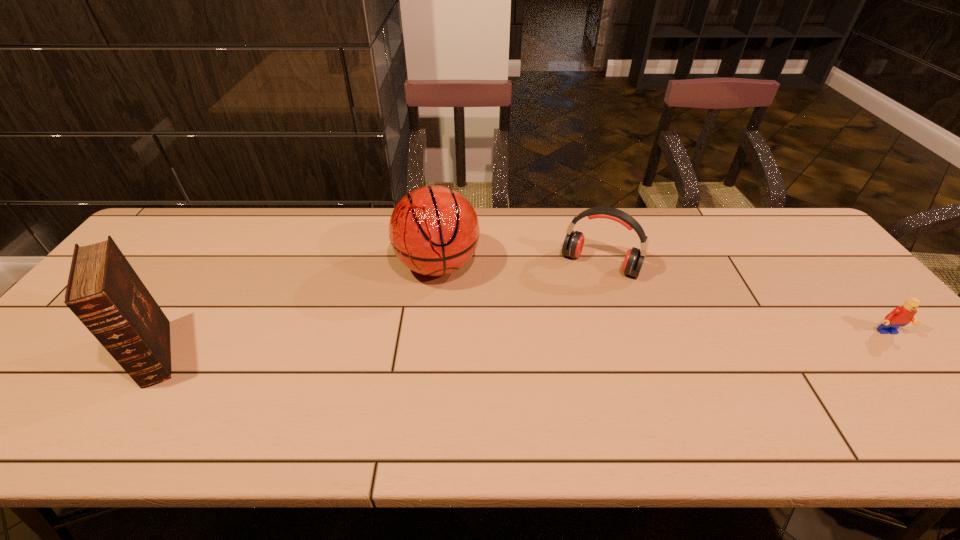
At what (x,y) coordinates should I click in order to perform the action: click on free region located on the ear cups of the second object from right to left. Please return your answer as a coordinate pair (x, y). The height and width of the screenshot is (540, 960). Looking at the image, I should click on (566, 325).

I want to click on blank space located 0.150m on the side with spill of the basketball, so click(x=443, y=338).

Locate an element on the screen. The width and height of the screenshot is (960, 540). free space located on the side with spill of the basketball is located at coordinates (442, 320).

The height and width of the screenshot is (540, 960). Find the location of `vacant area situated on the side with spill of the basketball`. vacant area situated on the side with spill of the basketball is located at coordinates (442, 326).

You are a GUI agent. You are given a task and a screenshot of the screen. Output one action in this format:
    pyautogui.click(x=<x>, y=<y>)
    Task: Click on the earphone at the far edge
    
    Given the screenshot: What is the action you would take?
    pyautogui.click(x=573, y=244)

In order to click on basketball at the far edge in this screenshot , I will do `click(434, 230)`.

Find the location of a particular element. The image size is (960, 540). object located in the near edge section of the desktop is located at coordinates (105, 293).

Where is `object positioned at the right edge`? object positioned at the right edge is located at coordinates (902, 315).

You are a GUI agent. You are given a task and a screenshot of the screen. Output one action in this format:
    pyautogui.click(x=<x>, y=<y>)
    Task: Click on the vacant space at the far edge of the desktop
    The width and height of the screenshot is (960, 540).
    Given the screenshot: What is the action you would take?
    click(x=348, y=239)

Identify the location of vacant point at the near edge. (479, 394).